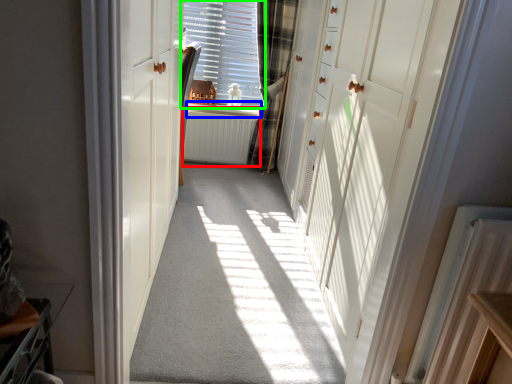
Question: Estimate the real-world distances between objects in this image. Which object is farther from radiator (highlighted by a red box), window sill (highlighted by a blue box) or window (highlighted by a green box)?

Choices:
 (A) window sill
 (B) window

Answer: (B)